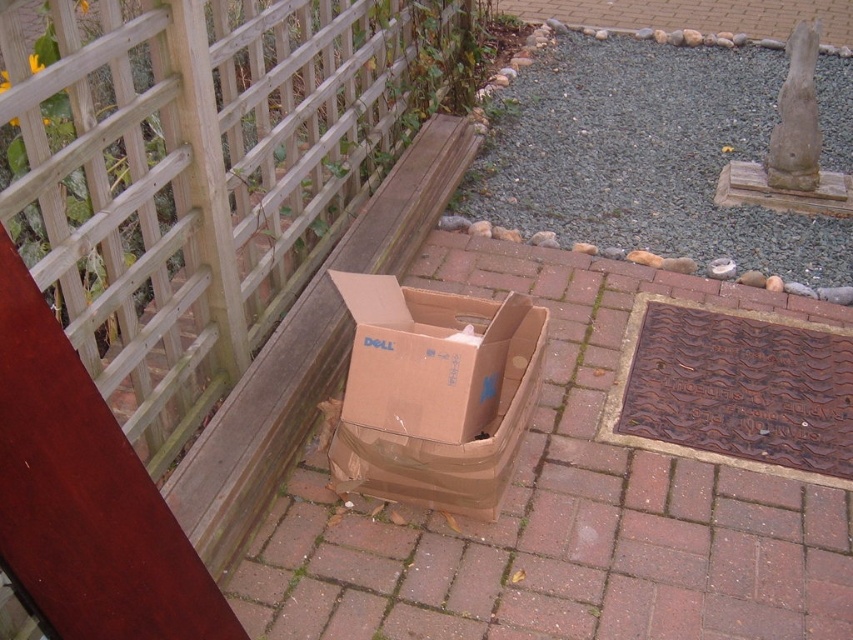
Can you confirm if wooden lattice at left is positioned to the left of brown cardboard box at center?

Indeed, wooden lattice at left is positioned on the left side of brown cardboard box at center.

Locate an element on the screen. wooden lattice at left is located at coordinates (199, 173).

This screenshot has height=640, width=853. What do you see at coordinates (199, 173) in the screenshot? I see `wooden lattice at left` at bounding box center [199, 173].

You are a GUI agent. You are given a task and a screenshot of the screen. Output one action in this format:
    pyautogui.click(x=<x>, y=<y>)
    Task: Click on the wooden lattice at left
    
    Given the screenshot: What is the action you would take?
    pyautogui.click(x=199, y=173)